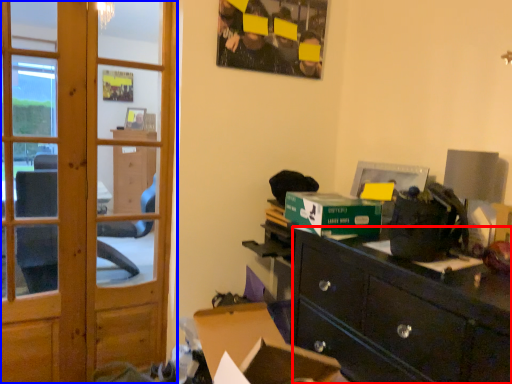
Question: Among these objects, which one is nearest to the camera, desk (highlighted by a red box) or door (highlighted by a blue box)?

Choices:
 (A) desk
 (B) door

Answer: (A)